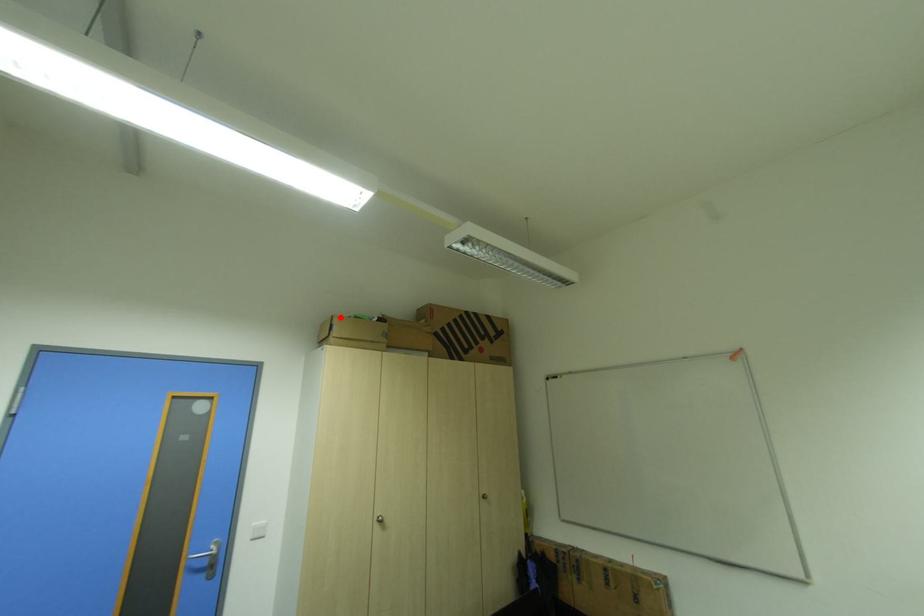
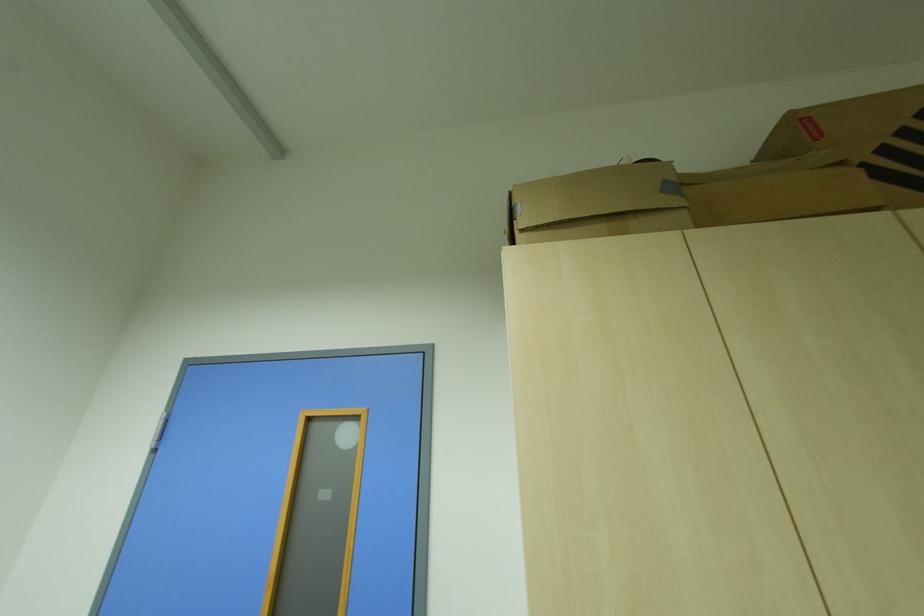
Find the pixel in the second image that matches the highlighted location in the first image.

(517, 195)